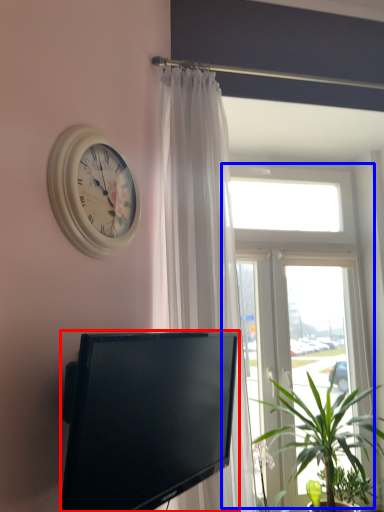
Question: Which of the following is the farthest to the observer, television (highlighted by a red box) or window (highlighted by a blue box)?

Choices:
 (A) television
 (B) window

Answer: (B)